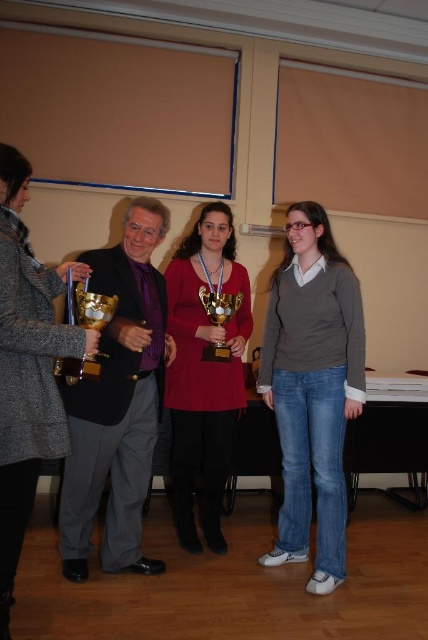
You are a photographer at the event and want to take a photo that clearly shows both the gray wool coat at left and the matte gold trophy at center. Which object should you focus on first to ensure both are in focus?

You should focus on the gray wool coat at left first because it is closer to the viewer than the matte gold trophy at center, so focusing on the closer object will help both be in focus.

You are organizing a display case for a museum exhibit. The case has a shelf that can only accommodate items up to 30 cm in width. You need to place both the gray wool coat at left and the gold shiny trophy at left inside. Based on the scene description, which item might not fit on the shelf?

The gray wool coat at left has a larger width than the gold shiny trophy at left. Since the shelf can only hold items up to 30 cm, if the coat exceeds 30 cm in width, it might not fit. However, the exact measurements aren

You are a photographer at the event. You need to take a photo of the gray wool coat at left and the matte gold trophy at center. Based on their positions, which object should be placed on the left side of the photo to maintain their actual arrangement?

The gray wool coat at left should be placed on the left side of the photo since it is positioned to the left of the matte gold trophy at center in the scene.